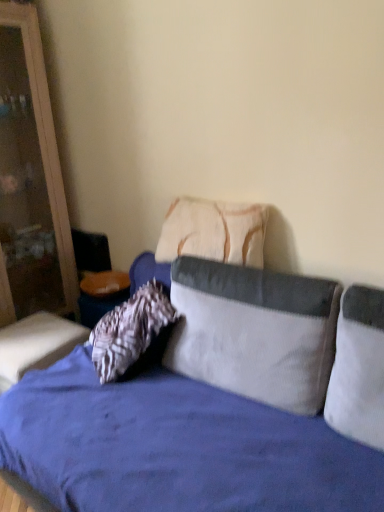
Where is `vacant area on top of velvet cushion at lower left (from a real-world perspective)`? vacant area on top of velvet cushion at lower left (from a real-world perspective) is located at coordinates (29, 334).